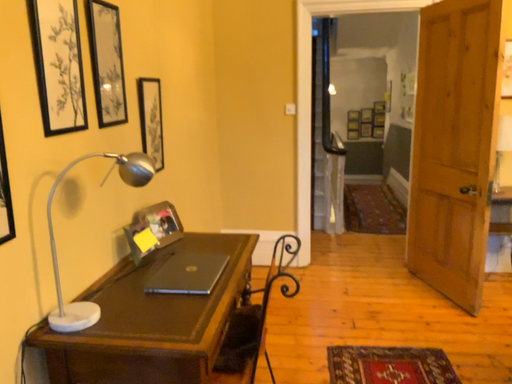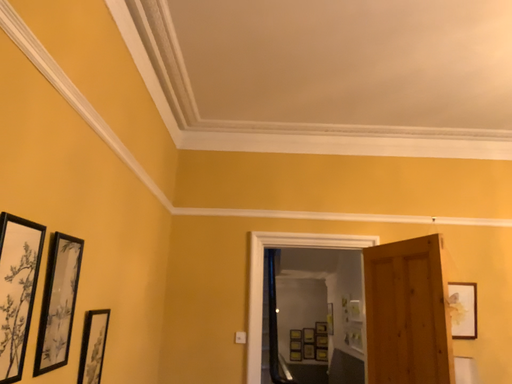
Question: Which way did the camera rotate in the video?

Choices:
 (A) rotated upward
 (B) rotated downward

Answer: (A)